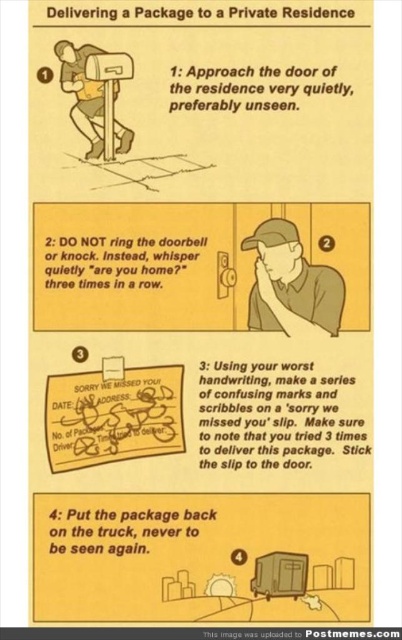
Question: Which point appears closest to the camera in this image?

Choices:
 (A) (114, 132)
 (B) (260, 275)

Answer: (A)

Question: Which object appears farthest from the camera in this image?

Choices:
 (A) metallic mailbox at upper left
 (B) brown cap at center

Answer: (B)

Question: Does brown cap at center appear over metallic mailbox at upper left?

Choices:
 (A) no
 (B) yes

Answer: (A)

Question: Observing the image, what is the correct spatial positioning of brown cap at center in reference to metallic mailbox at upper left?

Choices:
 (A) left
 (B) right

Answer: (B)

Question: Is brown cap at center in front of metallic mailbox at upper left?

Choices:
 (A) no
 (B) yes

Answer: (A)